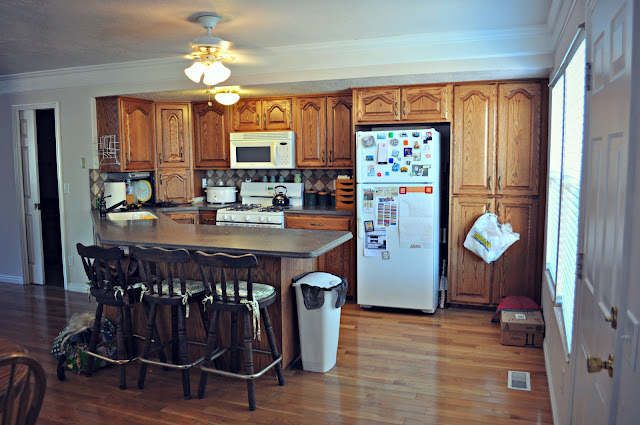
Find the location of `window`. window is located at coordinates (561, 163), (575, 195).